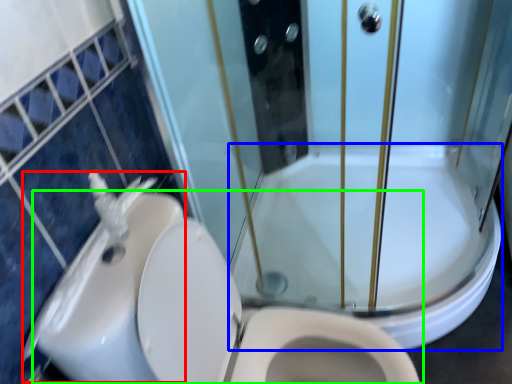
Question: Based on their relative distances, which object is farther from sink (highlighted by a red box)? Choose from bath (highlighted by a blue box) and toilet (highlighted by a green box).

Choices:
 (A) bath
 (B) toilet

Answer: (A)